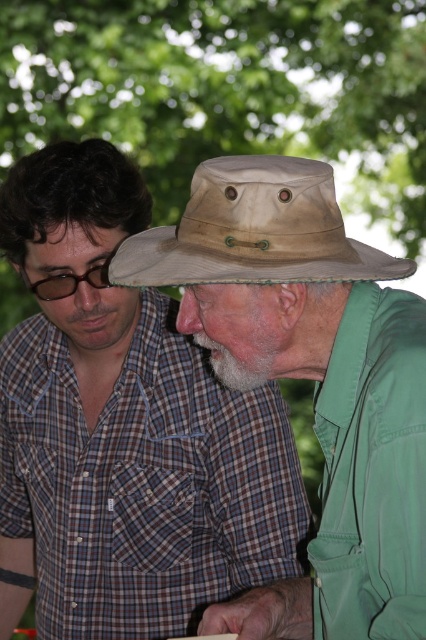
You are a photographer trying to capture both the khaki fabric hat at center and the tan canvas hat at center in a single shot. Since both are at the center, which hat will appear taller in the photo?

The khaki fabric hat at center will appear taller in the photo because it is much taller than the tan canvas hat at center.

You are a photographer standing at the camera position. You want to take a photo of the two people in the image. The focus point of your camera is set to point (100, 490). Will the two people be in focus in the photo?

The distance between point (100, 490) and the camera is 1.85 meters. Since both people are focused on the same object held by the younger man, they are likely positioned at a similar distance from the camera. Therefore, setting the focus point to this point should keep both individuals in focus in the photo.